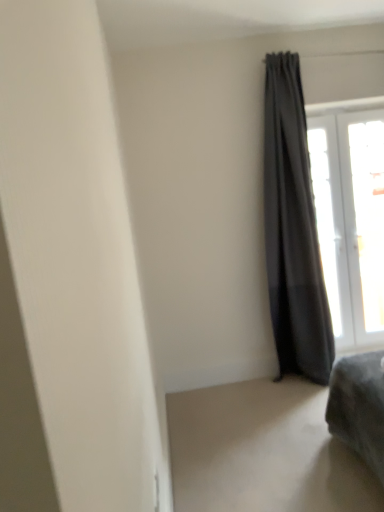
What is the approximate width of velvet gray ottoman at lower right?

velvet gray ottoman at lower right is 21.76 inches wide.

What is the approximate width of transparent glass window at upper right, the first window when ordered from left to right?

transparent glass window at upper right, the first window when ordered from left to right, is 18.36 centimeters in width.

This screenshot has width=384, height=512. What do you see at coordinates (351, 220) in the screenshot? I see `transparent glass window at upper right, which appears as the 2th window when viewed from the right` at bounding box center [351, 220].

Describe the element at coordinates (365, 222) in the screenshot. This screenshot has width=384, height=512. I see `transparent glass window at upper right, which ranks as the 2th window in left-to-right order` at that location.

Where is `dark gray fabric curtain at right`? Image resolution: width=384 pixels, height=512 pixels. dark gray fabric curtain at right is located at coordinates point(293,230).

Which point is more distant from viewer, [345,425] or [321,343]?

The point [321,343] is more distant.

The height and width of the screenshot is (512, 384). Find the location of `curtain lying on the left of velvet gray ottoman at lower right`. curtain lying on the left of velvet gray ottoman at lower right is located at coordinates (293, 230).

Looking at this image, is velvet gray ottoman at lower right positioned behind dark gray fabric curtain at right?

No.

Can you tell me how much velvet gray ottoman at lower right and dark gray fabric curtain at right differ in facing direction?

91.8 degrees.

From the image's perspective, which one is positioned higher, velvet gray ottoman at lower right or transparent glass window at upper right, the first window when ordered from left to right?

transparent glass window at upper right, the first window when ordered from left to right, appears higher in the image.

From a real-world perspective, which is physically above, velvet gray ottoman at lower right or transparent glass window at upper right, the first window when ordered from left to right?

transparent glass window at upper right, the first window when ordered from left to right.

Can we say velvet gray ottoman at lower right lies outside transparent glass window at upper right, which appears as the 2th window when viewed from the right?

velvet gray ottoman at lower right is positioned outside transparent glass window at upper right, which appears as the 2th window when viewed from the right.

How distant is velvet gray ottoman at lower right from transparent glass window at upper right, the first window when ordered from left to right?

velvet gray ottoman at lower right and transparent glass window at upper right, the first window when ordered from left to right, are 5.25 feet apart from each other.

Is velvet gray ottoman at lower right oriented towards transparent glass window at upper right, which ranks as the 2th window in left-to-right order?

No, velvet gray ottoman at lower right is not aimed at transparent glass window at upper right, which ranks as the 2th window in left-to-right order.

Considering the sizes of velvet gray ottoman at lower right and transparent glass window at upper right, the first window when ordered from right to left, in the image, is velvet gray ottoman at lower right bigger or smaller than transparent glass window at upper right, the first window when ordered from right to left,?

velvet gray ottoman at lower right is bigger than transparent glass window at upper right, the first window when ordered from right to left.

From a real-world perspective, relative to transparent glass window at upper right, the first window when ordered from right to left, is velvet gray ottoman at lower right vertically above or below?

velvet gray ottoman at lower right is below transparent glass window at upper right, the first window when ordered from right to left.

Is transparent glass window at upper right, the first window when ordered from left to right, facing towards dark gray fabric curtain at right?

No.

Is transparent glass window at upper right, the first window when ordered from left to right, next to dark gray fabric curtain at right and touching it?

There is a gap between transparent glass window at upper right, the first window when ordered from left to right, and dark gray fabric curtain at right.

From a real-world perspective, is transparent glass window at upper right, which appears as the 2th window when viewed from the right, positioned above or below dark gray fabric curtain at right?

From a real-world perspective, transparent glass window at upper right, which appears as the 2th window when viewed from the right, is physically below dark gray fabric curtain at right.

The height and width of the screenshot is (512, 384). In order to click on curtain that appears above the transparent glass window at upper right, which appears as the 2th window when viewed from the right (from a real-world perspective) in this screenshot , I will do `click(293, 230)`.

Which object is closer to the camera, transparent glass window at upper right, the first window when ordered from left to right, or transparent glass window at upper right, the first window when ordered from right to left?

Positioned in front is transparent glass window at upper right, the first window when ordered from left to right.

Considering the sizes of objects transparent glass window at upper right, the first window when ordered from left to right, and transparent glass window at upper right, which ranks as the 2th window in left-to-right order, in the image provided, who is taller, transparent glass window at upper right, the first window when ordered from left to right, or transparent glass window at upper right, which ranks as the 2th window in left-to-right order,?

With more height is transparent glass window at upper right, the first window when ordered from left to right.

From a real-world perspective, does transparent glass window at upper right, which appears as the 2th window when viewed from the right, sit lower than velvet gray ottoman at lower right?

No, from a real-world perspective, transparent glass window at upper right, which appears as the 2th window when viewed from the right, is not beneath velvet gray ottoman at lower right.

Consider the image. Does transparent glass window at upper right, which appears as the 2th window when viewed from the right, lie behind velvet gray ottoman at lower right?

Yes.

Find the location of `the 1st window behind when counting from the velvet gray ottoman at lower right`. the 1st window behind when counting from the velvet gray ottoman at lower right is located at coordinates (351, 220).

Is transparent glass window at upper right, the first window when ordered from left to right, located outside velvet gray ottoman at lower right?

transparent glass window at upper right, the first window when ordered from left to right, is positioned outside velvet gray ottoman at lower right.

Does dark gray fabric curtain at right have a larger size compared to velvet gray ottoman at lower right?

Yes.

Is dark gray fabric curtain at right positioned before velvet gray ottoman at lower right?

No.

Is velvet gray ottoman at lower right at the back of dark gray fabric curtain at right?

No, dark gray fabric curtain at right is not facing away from velvet gray ottoman at lower right.

Looking at this image, can you tell me how much dark gray fabric curtain at right and velvet gray ottoman at lower right differ in facing direction?

They differ by 91.8 degrees in their facing directions.

This screenshot has height=512, width=384. What are the coordinates of `curtain lying above the velvet gray ottoman at lower right (from the image's perspective)` in the screenshot? It's located at (293, 230).

Image resolution: width=384 pixels, height=512 pixels. Identify the location of furniture that appears in front of the transparent glass window at upper right, which appears as the 2th window when viewed from the right. 359,407.

Considering their positions, is velvet gray ottoman at lower right positioned closer to transparent glass window at upper right, which appears as the 2th window when viewed from the right, than transparent glass window at upper right, which ranks as the 2th window in left-to-right order?

The object closer to transparent glass window at upper right, which appears as the 2th window when viewed from the right, is transparent glass window at upper right, which ranks as the 2th window in left-to-right order.

In the scene shown: Looking at the image, which one is located closer to transparent glass window at upper right, the first window when ordered from left to right, velvet gray ottoman at lower right or dark gray fabric curtain at right?

dark gray fabric curtain at right lies closer to transparent glass window at upper right, the first window when ordered from left to right, than the other object.

From the image, which object appears to be nearer to transparent glass window at upper right, which appears as the 2th window when viewed from the right, transparent glass window at upper right, the first window when ordered from right to left, or velvet gray ottoman at lower right?

transparent glass window at upper right, the first window when ordered from right to left, lies closer to transparent glass window at upper right, which appears as the 2th window when viewed from the right, than the other object.

Based on their spatial positions, is transparent glass window at upper right, which ranks as the 2th window in left-to-right order, or transparent glass window at upper right, the first window when ordered from left to right, further from velvet gray ottoman at lower right?

Among the two, transparent glass window at upper right, which ranks as the 2th window in left-to-right order, is located further to velvet gray ottoman at lower right.

Which object lies nearer to the anchor point dark gray fabric curtain at right, transparent glass window at upper right, the first window when ordered from left to right, or transparent glass window at upper right, the first window when ordered from right to left?

The object closer to dark gray fabric curtain at right is transparent glass window at upper right, the first window when ordered from left to right.

When comparing their distances from transparent glass window at upper right, which ranks as the 2th window in left-to-right order, does dark gray fabric curtain at right or transparent glass window at upper right, which appears as the 2th window when viewed from the right, seem closer?

Based on the image, transparent glass window at upper right, which appears as the 2th window when viewed from the right, appears to be nearer to transparent glass window at upper right, which ranks as the 2th window in left-to-right order.

Considering their positions, is dark gray fabric curtain at right positioned closer to velvet gray ottoman at lower right than transparent glass window at upper right, which ranks as the 2th window in left-to-right order?

Among the two, dark gray fabric curtain at right is located nearer to velvet gray ottoman at lower right.

Estimate the real-world distances between objects in this image. Which object is closer to velvet gray ottoman at lower right, transparent glass window at upper right, which appears as the 2th window when viewed from the right, or dark gray fabric curtain at right?

dark gray fabric curtain at right is closer to velvet gray ottoman at lower right.

Image resolution: width=384 pixels, height=512 pixels. Find the location of `curtain located between velvet gray ottoman at lower right and transparent glass window at upper right, the first window when ordered from left to right, in the depth direction`. curtain located between velvet gray ottoman at lower right and transparent glass window at upper right, the first window when ordered from left to right, in the depth direction is located at coordinates (293, 230).

Identify the location of curtain between velvet gray ottoman at lower right and transparent glass window at upper right, the first window when ordered from right to left, from front to back. Image resolution: width=384 pixels, height=512 pixels. (293, 230).

The width and height of the screenshot is (384, 512). What are the coordinates of `window situated between dark gray fabric curtain at right and transparent glass window at upper right, the first window when ordered from right to left, from left to right` in the screenshot? It's located at (351, 220).

You are a GUI agent. You are given a task and a screenshot of the screen. Output one action in this format:
    pyautogui.click(x=<x>, y=<y>)
    Task: Click on the window between velvet gray ottoman at lower right and transparent glass window at upper right, the first window when ordered from right to left, from front to back
    
    Given the screenshot: What is the action you would take?
    pyautogui.click(x=351, y=220)